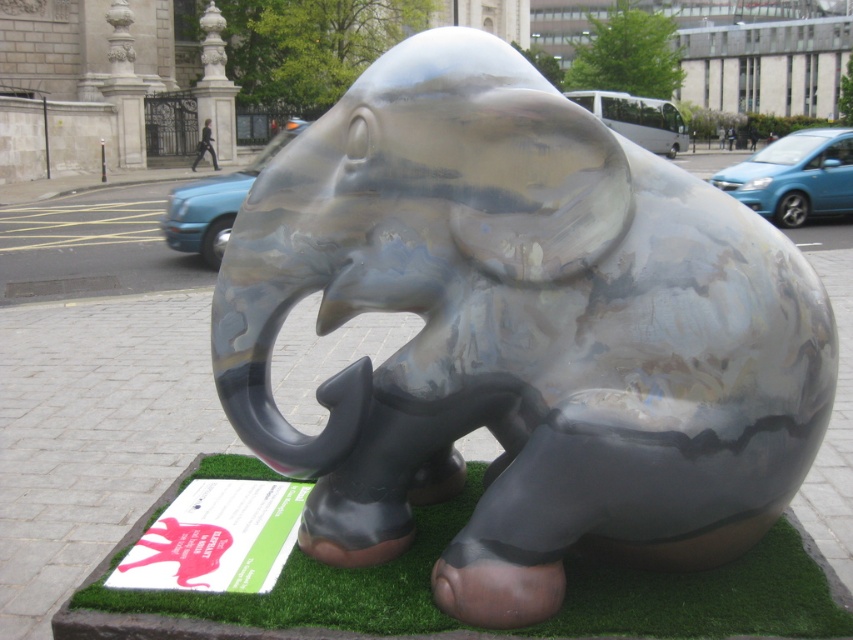
You are a photographer trying to capture a clear shot of the shiny metallic elephant at center and the green artificial turf at lower center. Since the sign in front is blocking your view, you decide to move to a different position. Which object will appear taller in your photo if you stand back far enough?

The shiny metallic elephant at center will appear taller in the photo because it has a greater height compared to the green artificial turf at lower center.

You are a maintenance worker assigned to clean the shiny metallic elephant at center and the green artificial turf at lower center. You have a 12 inch long cleaning tool. Can you reach both areas without moving your position?

The distance between the shiny metallic elephant at center and the green artificial turf at lower center is 14.14 inches. Since your tool is only 12 inches long, you cannot reach both areas without moving your position.

You are standing facing the shiny metallic elephant at center and the green artificial turf at lower center. Which object is positioned to the left?

The green artificial turf at lower center is to the left of the shiny metallic elephant at center.